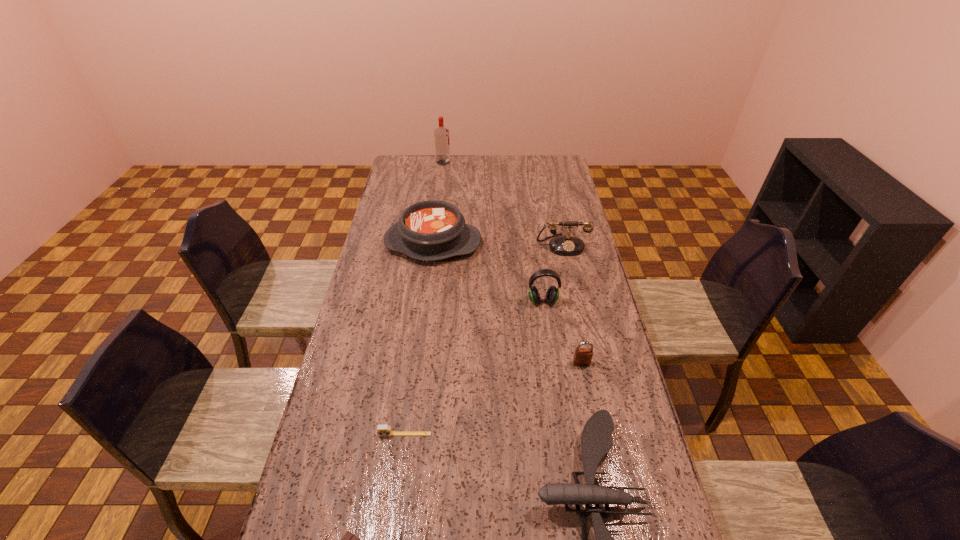
Image resolution: width=960 pixels, height=540 pixels. In the image, there is a desktop. What are the coordinates of `vacant space at the left edge` in the screenshot? It's located at (359, 396).

Where is `free space at the right edge`? This screenshot has height=540, width=960. free space at the right edge is located at coordinates (552, 190).

At what (x,y) coordinates should I click in order to perform the action: click on vacant space at the far right corner of the desktop. Please return your answer as a coordinate pair (x, y). The height and width of the screenshot is (540, 960). Looking at the image, I should click on (537, 160).

This screenshot has width=960, height=540. I want to click on free spot between the casserole and the fifth farthest object, so click(x=507, y=303).

Locate an element on the screen. The image size is (960, 540). empty location between the tape measure and the farthest object is located at coordinates (424, 298).

At what (x,y) coordinates should I click in order to perform the action: click on free space between the padlock and the telephone. Please return your answer as a coordinate pair (x, y). Image resolution: width=960 pixels, height=540 pixels. Looking at the image, I should click on (572, 304).

Image resolution: width=960 pixels, height=540 pixels. What are the coordinates of `vacant point located between the fifth farthest object and the headset` in the screenshot? It's located at (562, 332).

Locate an element on the screen. Image resolution: width=960 pixels, height=540 pixels. blank region between the fourth nearest object and the tape measure is located at coordinates (493, 399).

At what (x,y) coordinates should I click in order to perform the action: click on free area in between the casserole and the second shortest object. Please return your answer as a coordinate pair (x, y). The height and width of the screenshot is (540, 960). Looking at the image, I should click on (419, 339).

The image size is (960, 540). What are the coordinates of `free spot between the padlock and the casserole` in the screenshot? It's located at pyautogui.click(x=507, y=303).